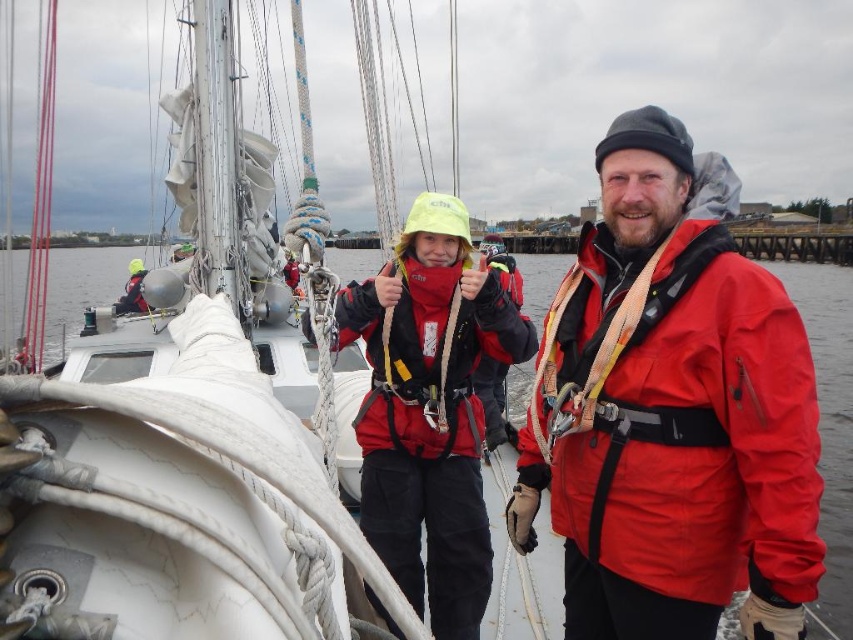
Question: Which point is farther from the camera taking this photo?

Choices:
 (A) (x=715, y=480)
 (B) (x=846, y=595)
 (C) (x=125, y=561)
 (D) (x=404, y=531)

Answer: (B)

Question: Is matte red jacket at center bigger than clear water at center?

Choices:
 (A) yes
 (B) no

Answer: (B)

Question: Which of these objects is positioned farthest from the white matte sailboat at upper center?

Choices:
 (A) matte black jacket at center
 (B) clear water at center
 (C) matte red jacket at center

Answer: (B)

Question: Does white matte sailboat at upper center appear on the right side of clear water at center?

Choices:
 (A) yes
 (B) no

Answer: (B)

Question: Which of the following is the farthest from the observer?

Choices:
 (A) white matte sailboat at upper center
 (B) matte black jacket at center
 (C) matte red jacket at center

Answer: (B)

Question: Is matte black jacket at center to the left of matte red life jacket at center from the viewer's perspective?

Choices:
 (A) no
 (B) yes

Answer: (B)